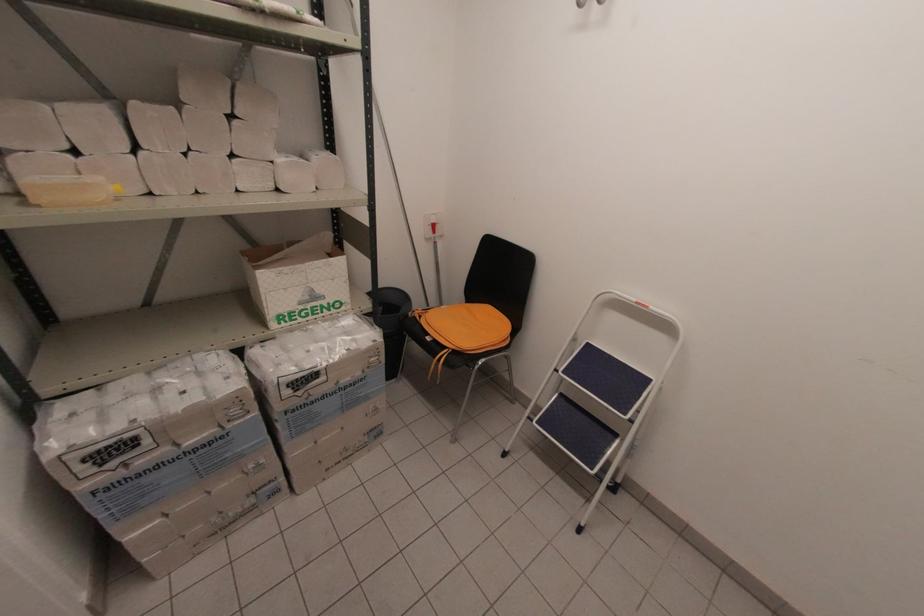
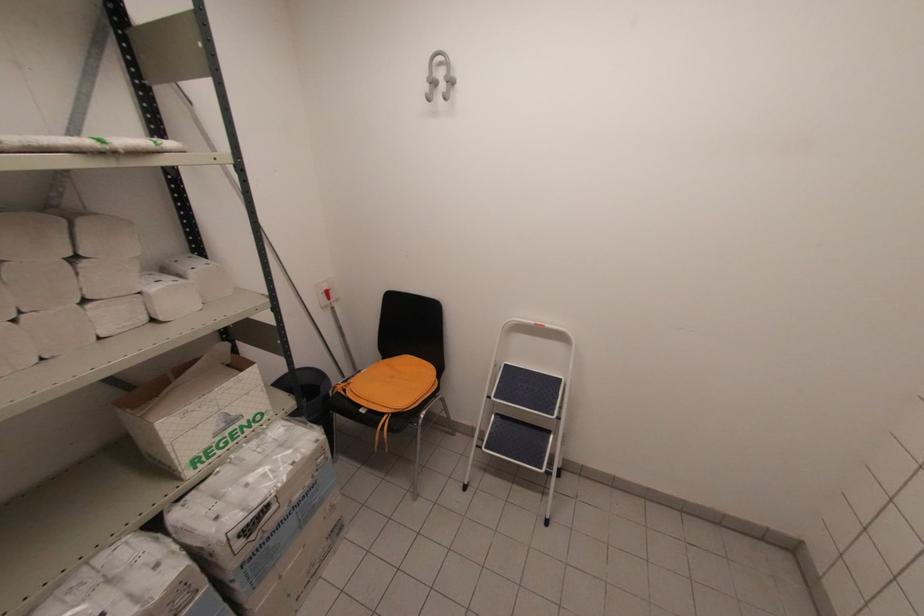
Question: The images are taken continuously from a first-person perspective. In which direction is your viewpoint rotating?

Choices:
 (A) Left
 (B) Right
 (C) Up
 (D) Down

Answer: (B)